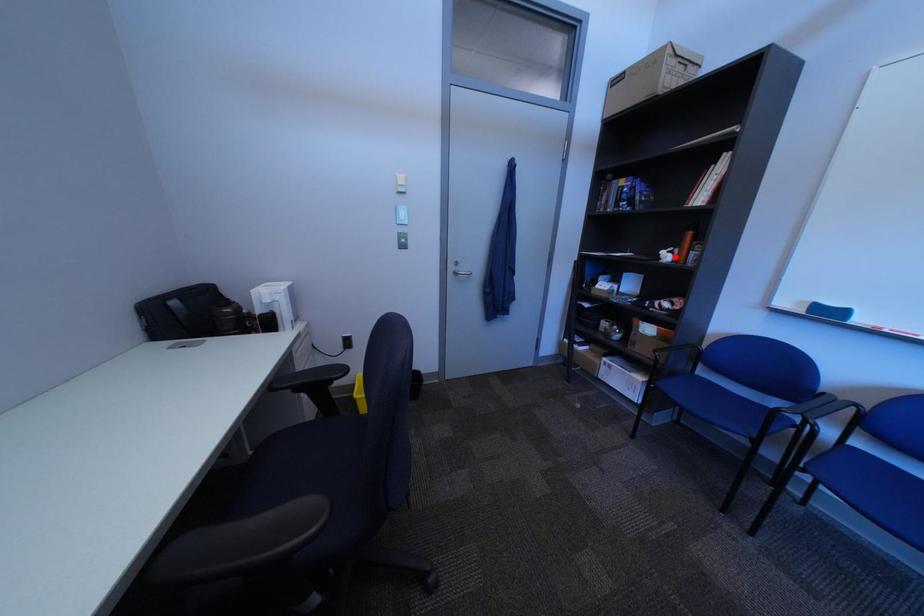
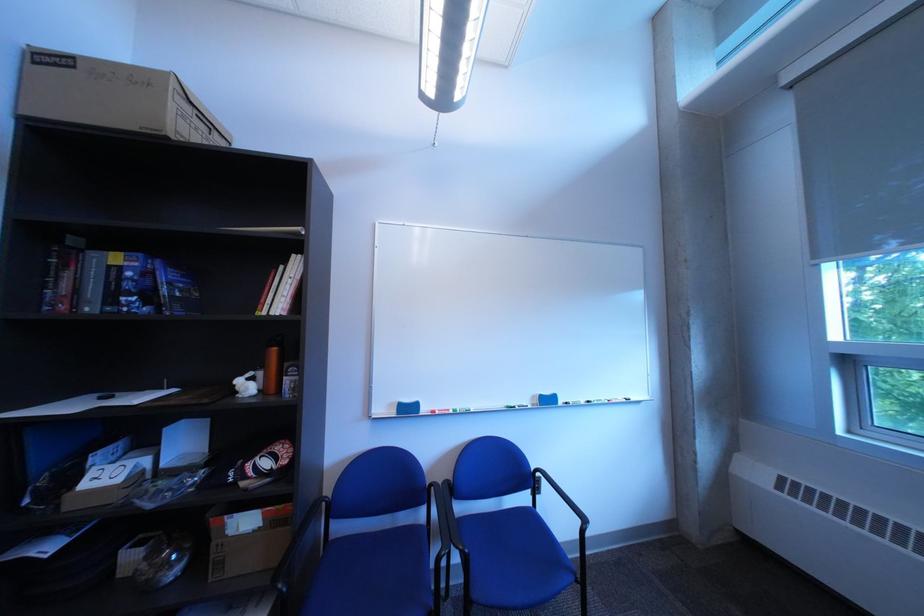
Find the pixel in the second image that matches the highlighted location in the first image.

(249, 387)